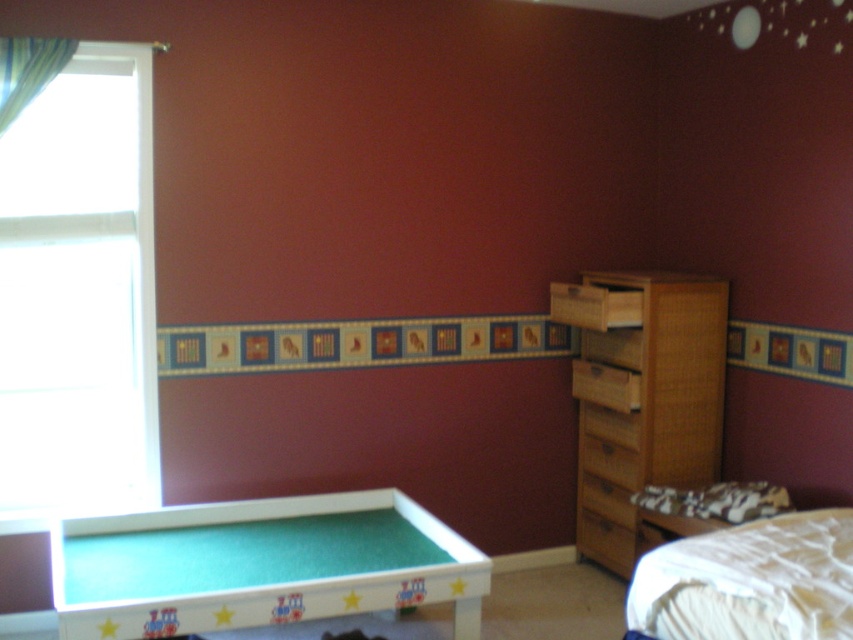
Question: Can you confirm if white glass window at left is positioned above woven wood drawer at center right?

Choices:
 (A) yes
 (B) no

Answer: (A)

Question: Which point is farther to the camera?

Choices:
 (A) wooden drawer at right
 (B) white soft bed at lower right

Answer: (A)

Question: Can you confirm if green felt billiard table at lower left is bigger than white soft bed at lower right?

Choices:
 (A) no
 (B) yes

Answer: (B)

Question: Which of the following is the closest to the observer?

Choices:
 (A) (119, 404)
 (B) (645, 422)
 (C) (224, 536)

Answer: (C)

Question: Which of these objects is positioned farthest from the white soft bed at lower right?

Choices:
 (A) green felt billiard table at lower left
 (B) wooden drawer at right
 (C) white glass window at left
 (D) woven wood drawer at center right

Answer: (C)

Question: Can you confirm if white glass window at left is positioned to the right of woven wood drawer at center right?

Choices:
 (A) no
 (B) yes

Answer: (A)